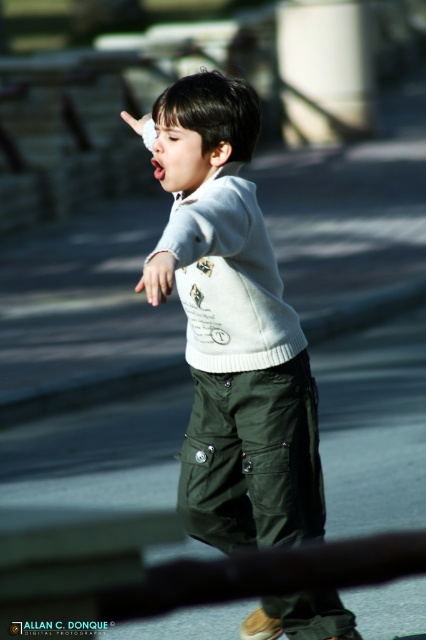
Consider the image. Is white matte sweater at center further to camera compared to white knitted sweater at center?

That is False.

The image size is (426, 640). Find the location of `white matte sweater at center`. white matte sweater at center is located at coordinates [235, 330].

Between point (256, 308) and point (233, 189), which one is positioned behind?

Positioned behind is point (256, 308).

Where is `white matte sweater at center`? This screenshot has height=640, width=426. white matte sweater at center is located at coordinates (235, 330).

Can you confirm if white knitted sweater at center is thinner than white matte hand at center?

Yes, white knitted sweater at center is thinner than white matte hand at center.

Which is above, white knitted sweater at center or white matte hand at center?

white matte hand at center

Where is `white knitted sweater at center`? The width and height of the screenshot is (426, 640). white knitted sweater at center is located at coordinates (229, 276).

Locate an element on the screen. The height and width of the screenshot is (640, 426). white knitted sweater at center is located at coordinates (229, 276).

Is white matte sweater at center positioned behind white matte hand at center?

No, white matte sweater at center is in front of white matte hand at center.

This screenshot has height=640, width=426. Describe the element at coordinates (235, 330) in the screenshot. I see `white matte sweater at center` at that location.

In order to click on white matte sweater at center in this screenshot , I will do `click(235, 330)`.